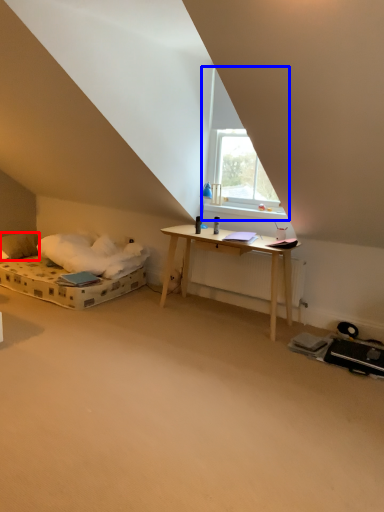
Question: Which of the following is the farthest to the observer, pillow (highlighted by a red box) or window (highlighted by a blue box)?

Choices:
 (A) pillow
 (B) window

Answer: (A)